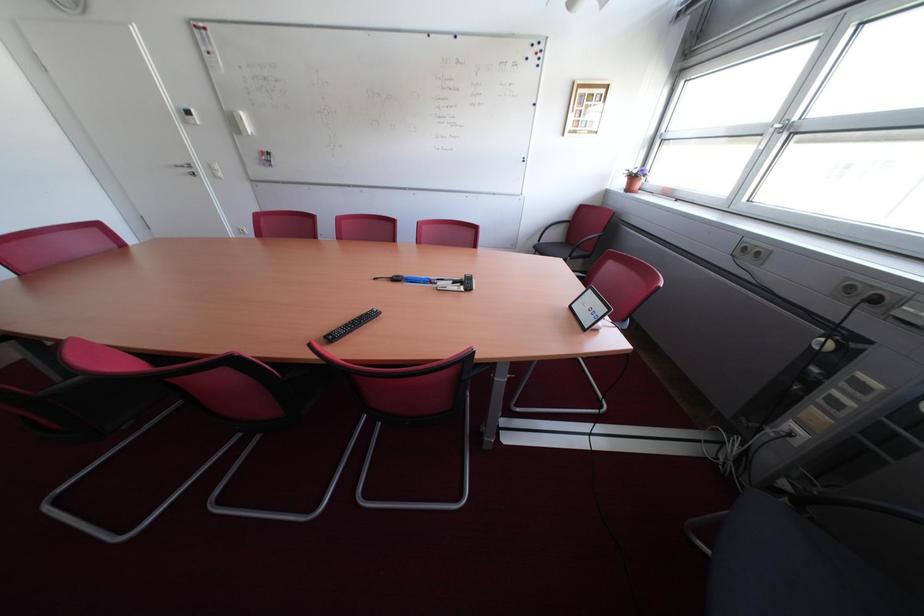
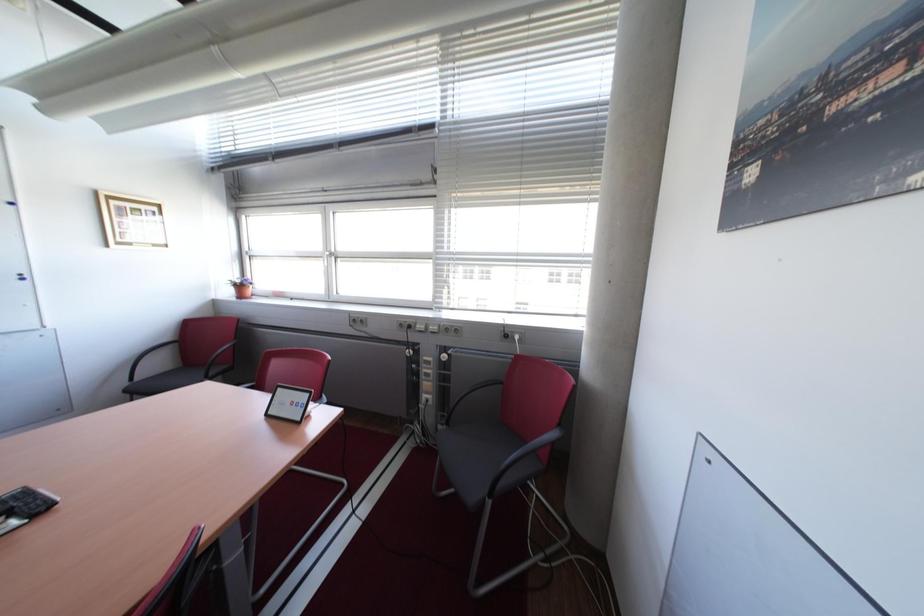
Question: The camera is either moving clockwise (left) or counter-clockwise (right) around the object. The first image is from the beginning of the video and the second image is from the end. Is the camera moving left or right when shooting the video?

Choices:
 (A) Left
 (B) Right

Answer: (A)